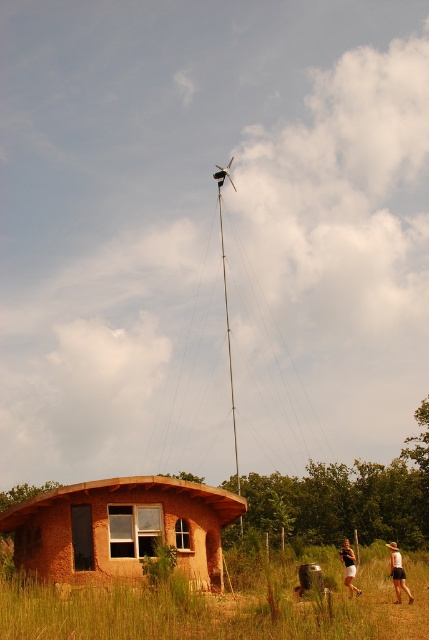
Who is more distant from viewer, (82, 611) or (346, 563)?

Positioned behind is point (346, 563).

Between point (263, 627) and point (341, 545), which one is positioned in front?

Positioned in front is point (263, 627).

You are a GUI agent. You are given a task and a screenshot of the screen. Output one action in this format:
    pyautogui.click(x=<x>, y=<y>)
    Task: Click on the green grass at lower center
    
    Given the screenshot: What is the action you would take?
    pyautogui.click(x=223, y=608)

Measure the distance between point [142,509] and camera.

The distance of point [142,509] from camera is 104.56 feet.

Describe the element at coordinates (120, 529) in the screenshot. I see `brown clay hut at lower left` at that location.

At what (x,y) coordinates should I click in order to perform the action: click on brown clay hut at lower left. Please return your answer as a coordinate pair (x, y). Looking at the image, I should click on (120, 529).

Where is `brown clay hut at lower left`? The width and height of the screenshot is (429, 640). brown clay hut at lower left is located at coordinates (120, 529).

Is point (325, 563) closer to viewer compared to point (166, 476)?

No, it is not.

Describe the element at coordinates (223, 608) in the screenshot. The width and height of the screenshot is (429, 640). I see `green grass at lower center` at that location.

Locate an element on the screen. The image size is (429, 640). green grass at lower center is located at coordinates (223, 608).